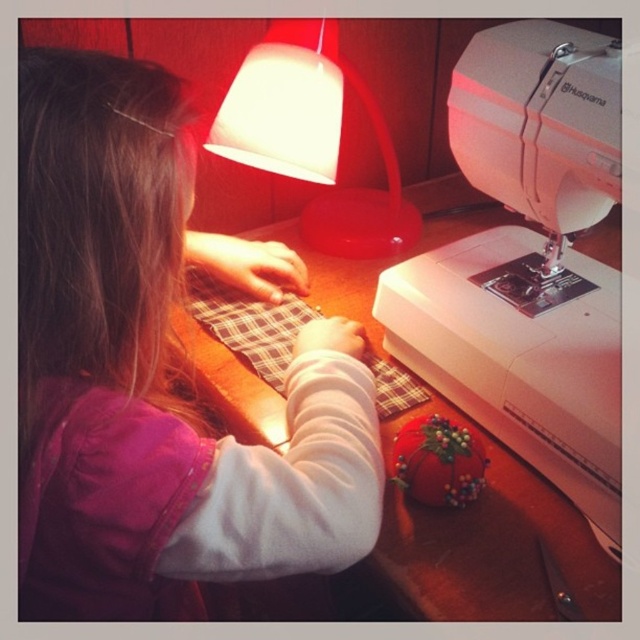
You are trying to place a rectangular box that is as wide as the wooden table at center on the matte plastic lamp at upper center. Will the box fit on the lamp?

The wooden table at center is wider than the matte plastic lamp at upper center, so the box, which is as wide as the wooden table at center, will not fit on the matte plastic lamp at upper center.

You are a delivery person who needs to place a new rectangular box that is 1 meter wide onto the wooden table at center. Considering the white plastic sewing machine at right, will the box fit on the table without moving the sewing machine?

The white plastic sewing machine at right is thinner than the wooden table at center. Since the sewing machine is thinner, there might be enough space left on the table to place the 1 meter wide box without moving the sewing machine, but the exact dimensions of the table and box placement are needed for certainty.